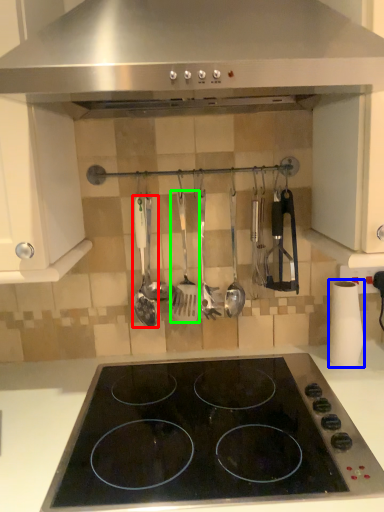
Question: Which object is positioned closest to spatula (highlighted by a red box)? Select from paper towel (highlighted by a blue box) and spatula (highlighted by a green box).

Choices:
 (A) paper towel
 (B) spatula

Answer: (B)